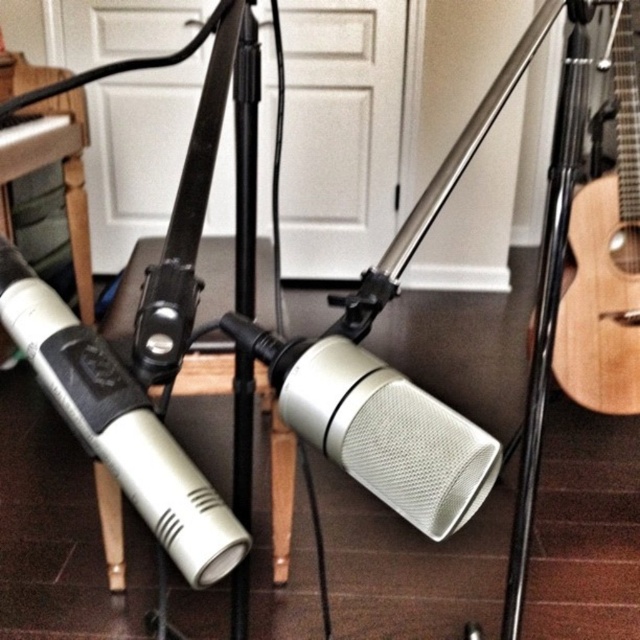
Question: Is the position of silver metallic microphone at left more distant than that of natural wood acoustic guitar at right?

Choices:
 (A) no
 (B) yes

Answer: (A)

Question: Estimate the real-world distances between objects in this image. Which object is farther from the silver metallic microphone at left?

Choices:
 (A) silver mesh microphone at center
 (B) natural wood acoustic guitar at right

Answer: (B)

Question: Does silver mesh microphone at center lie behind natural wood acoustic guitar at right?

Choices:
 (A) yes
 (B) no

Answer: (B)

Question: Which point is closer to the camera?

Choices:
 (A) silver mesh microphone at center
 (B) natural wood acoustic guitar at right

Answer: (A)

Question: Does silver metallic microphone at left appear under natural wood acoustic guitar at right?

Choices:
 (A) no
 (B) yes

Answer: (B)

Question: Which object is closer to the camera taking this photo?

Choices:
 (A) natural wood acoustic guitar at right
 (B) silver metallic microphone at left
 (C) silver mesh microphone at center

Answer: (B)